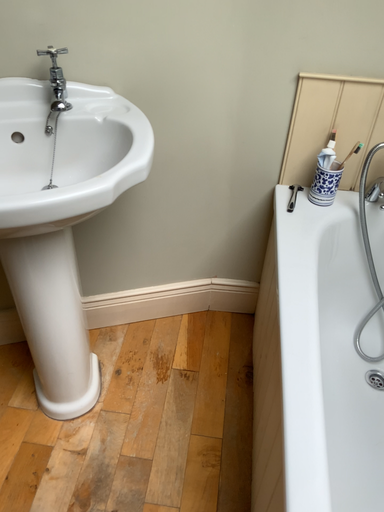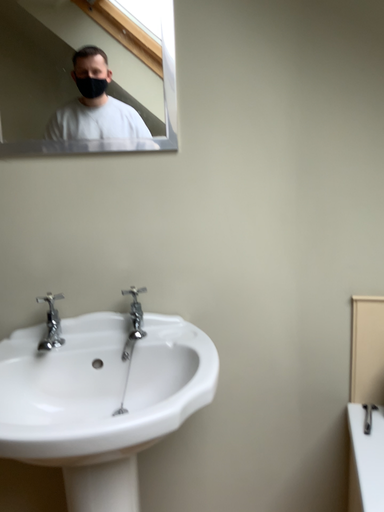
Question: How did the camera likely rotate when shooting the video?

Choices:
 (A) rotated downward
 (B) rotated upward

Answer: (B)